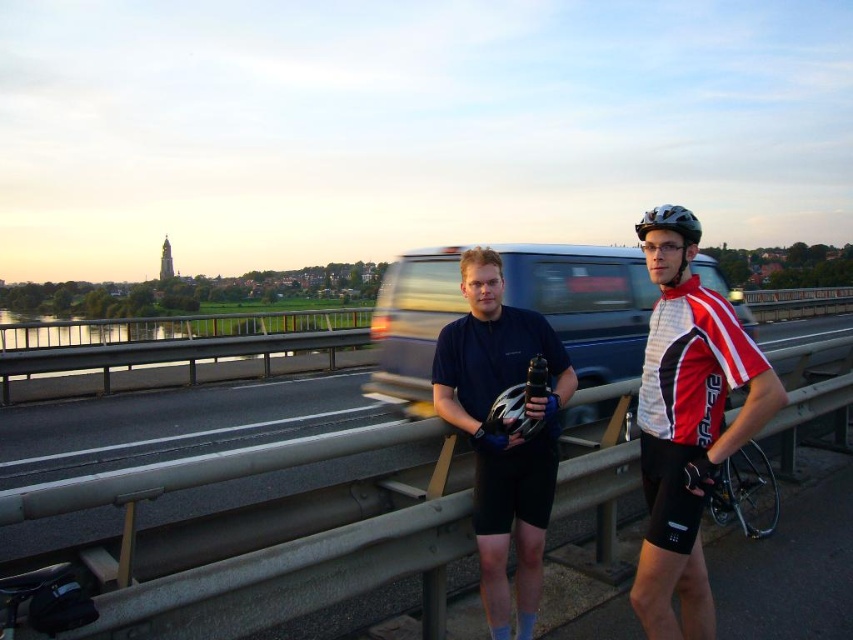
You are a cyclist who wants to place your matte black helmet at center and matte black helmet at upper right on a shelf. The shelf is 1 meter long. Can both helmets fit side by side on the shelf without overlapping?

The distance between the matte black helmet at center and matte black helmet at upper right is 1.01 meters, which is slightly longer than the shelf length of 1 meter. Therefore, both helmets cannot fit side by side on the shelf without overlapping.

You are a cyclist planning to cross the bridge and see the metallic blue van at center and the matte black helmet at center. Which object is wider?

The metallic blue van at center is wider than the matte black helmet at center.